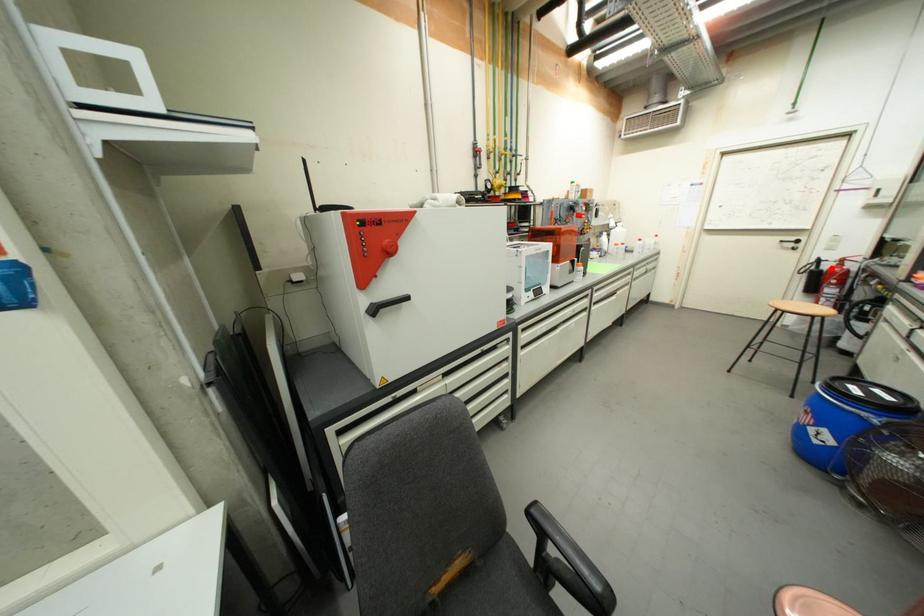
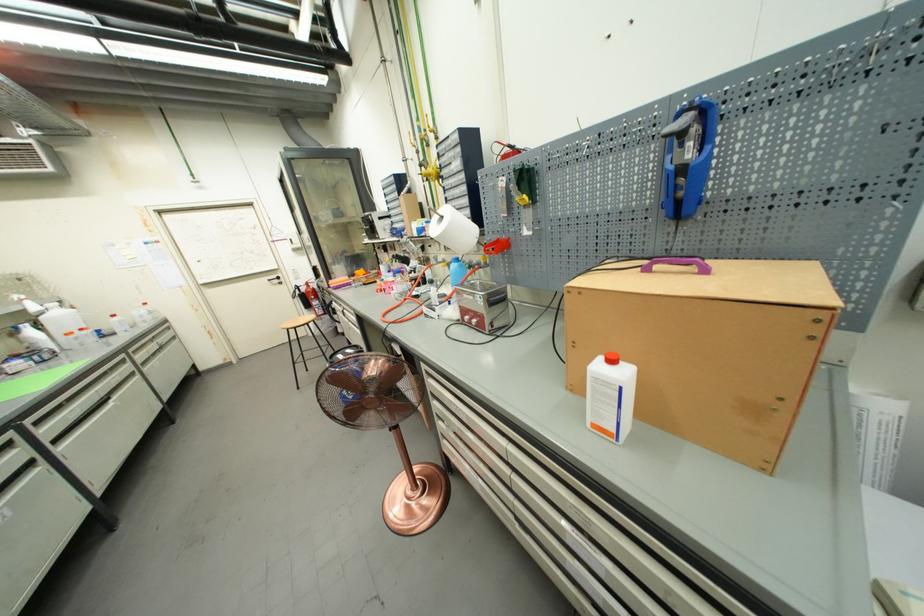
Locate, in the second image, the point that corresponds to the highlighted location in the first image.

(309, 291)